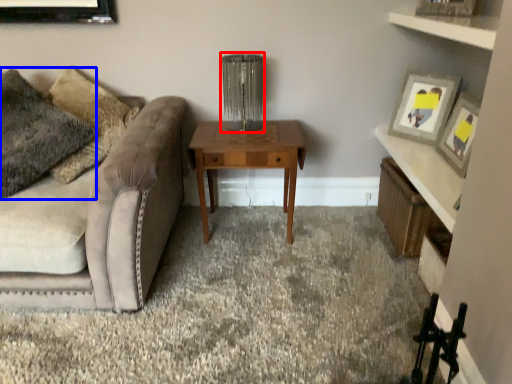
Question: Which object appears closest to the camera in this image, table lamp (highlighted by a red box) or pillow (highlighted by a blue box)?

Choices:
 (A) table lamp
 (B) pillow

Answer: (B)